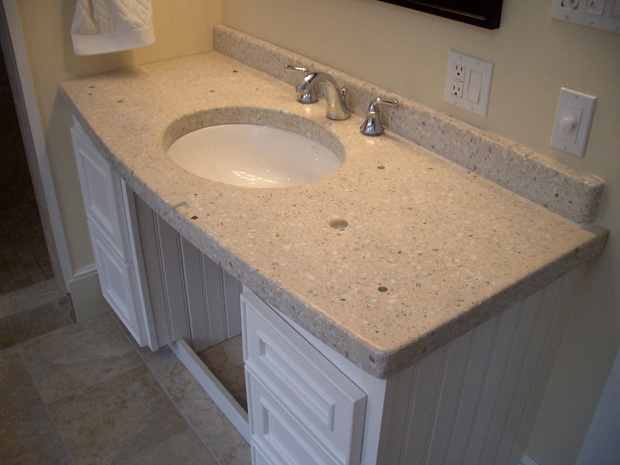
The height and width of the screenshot is (465, 620). Identify the location of drawer front. (307, 405), (280, 427), (104, 192), (105, 284).